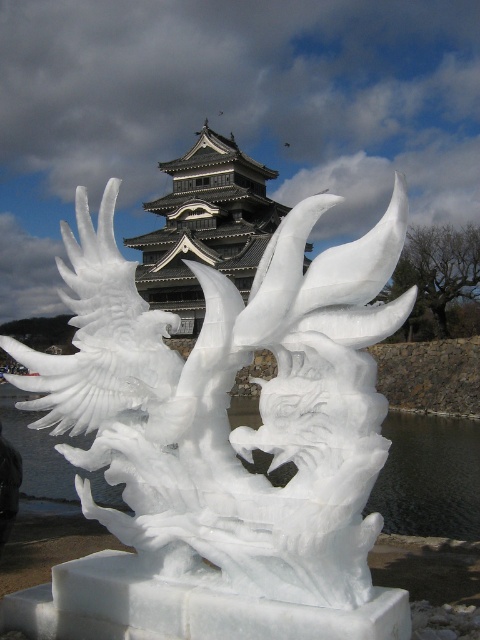
Question: Is white ice sculpture at center to the left of dark gray stone tower at center from the viewer's perspective?

Choices:
 (A) yes
 (B) no

Answer: (B)

Question: Can you confirm if white ice sculpture at center is positioned above dark gray stone tower at center?

Choices:
 (A) no
 (B) yes

Answer: (A)

Question: Does white ice sculpture at center appear on the right side of dark gray stone tower at center?

Choices:
 (A) yes
 (B) no

Answer: (A)

Question: Among these objects, which one is farthest from the camera?

Choices:
 (A) dark gray stone tower at center
 (B) white ice sculpture at center

Answer: (A)

Question: Among these objects, which one is nearest to the camera?

Choices:
 (A) white ice sculpture at center
 (B) dark gray stone tower at center

Answer: (A)